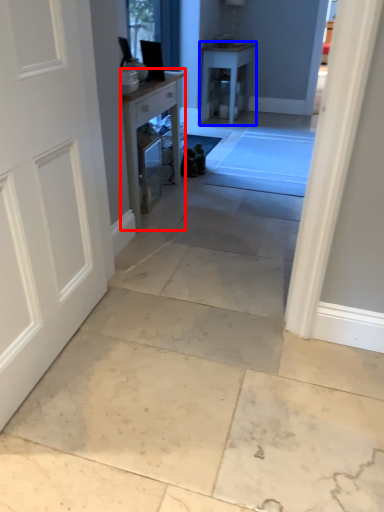
Question: Which of the following is the closest to the observer, table (highlighted by a red box) or table (highlighted by a blue box)?

Choices:
 (A) table
 (B) table

Answer: (A)